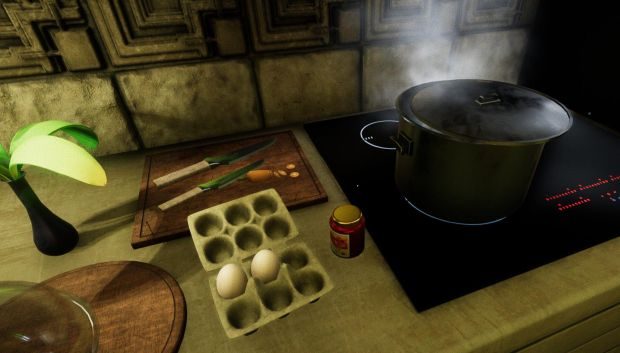
Find the location of `pot lid handle`. pot lid handle is located at coordinates (492, 96).